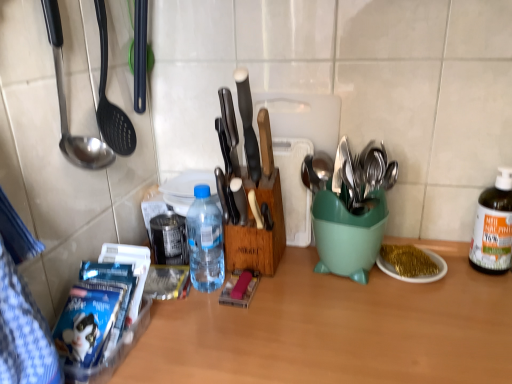
At what (x,y) coordinates should I click in order to perform the action: click on vacant space positioned to the left of green plastic spoon holder at right. Please return your answer as a coordinate pair (x, y). This screenshot has width=512, height=384. Looking at the image, I should click on (278, 288).